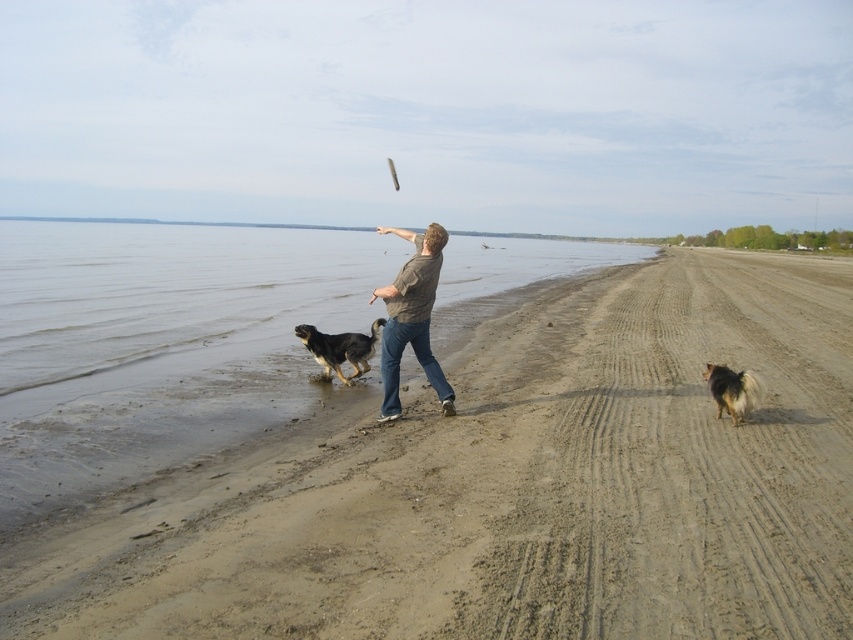
You are a drone operator trying to capture a photo of the black and white fur dog at center and the white plastic frisbee at center. The drone can only focus on objects within a 25 meter radius. Will both objects be in focus?

The black and white fur dog at center is 30.09 meters away from the white plastic frisbee at center. Since the drone requires both objects to be within a 25 meter radius of each other to focus, the distance between them exceeds the limit. Therefore, the drone cannot focus on both objects simultaneously.

You are a photographer trying to capture the fluffy brown dog at right while standing on the brown sand at lower left. Can you fit the entire dog in your camera frame without moving your position? Explain using the spatial details provided.

The brown sand at lower left might be wider than the fluffy brown dog at right, so there is a possibility that the width of the sand could accommodate the dog within the frame. However, without exact measurements, it is uncertain if the dog will fit entirely. Consider adjusting your angle or zoom for better framing.

You are a photographer trying to capture the perfect shot of the black and white fur dog at center. To do this, you need to position your camera precisely. According to the coordinates provided, where should you aim your camera to ensure the dog is centered in your shot?

The black and white fur dog at center is located at coordinates point [340,348], so you should aim your camera at that exact point to center the dog in your shot.